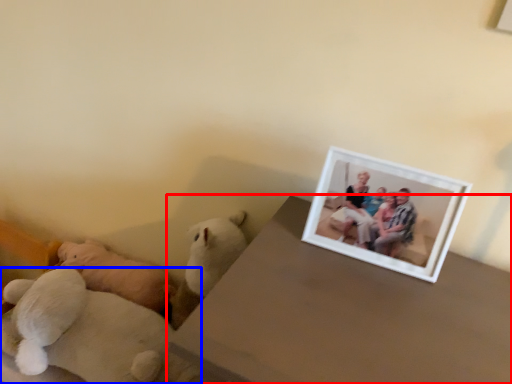
Question: Which object is further to the camera taking this photo, table (highlighted by a red box) or teddy bear (highlighted by a blue box)?

Choices:
 (A) table
 (B) teddy bear

Answer: (B)